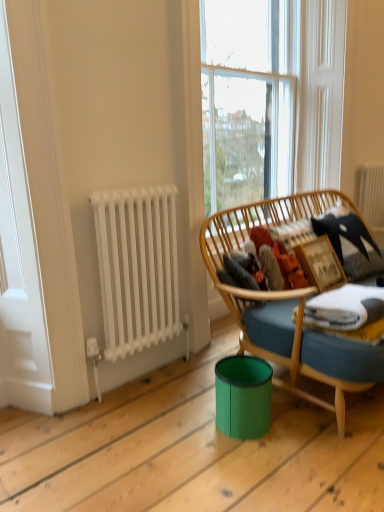
Question: Considering the relative positions of green plastic trash bin at lower center and white metallic radiator at left, marked as the 1th radiator in a front-to-back arrangement, in the image provided, is green plastic trash bin at lower center in front of white metallic radiator at left, marked as the 1th radiator in a front-to-back arrangement,?

Choices:
 (A) no
 (B) yes

Answer: (B)

Question: Is green plastic trash bin at lower center to the right of white metallic radiator at left, the 1th radiator positioned from the left, from the viewer's perspective?

Choices:
 (A) no
 (B) yes

Answer: (B)

Question: Considering the relative sizes of green plastic trash bin at lower center and white metallic radiator at left, which appears as the second radiator when viewed from the right, in the image provided, is green plastic trash bin at lower center smaller than white metallic radiator at left, which appears as the second radiator when viewed from the right,?

Choices:
 (A) no
 (B) yes

Answer: (B)

Question: Does green plastic trash bin at lower center have a lesser height compared to white metallic radiator at left, placed as the 1th radiator when sorted from bottom to top?

Choices:
 (A) yes
 (B) no

Answer: (A)

Question: Considering the relative sizes of green plastic trash bin at lower center and white metallic radiator at left, placed as the 1th radiator when sorted from bottom to top, in the image provided, is green plastic trash bin at lower center thinner than white metallic radiator at left, placed as the 1th radiator when sorted from bottom to top,?

Choices:
 (A) yes
 (B) no

Answer: (B)

Question: Would you say fuzzy fabric at center is to the left or to the right of wooden picture frame at right in the picture?

Choices:
 (A) right
 (B) left

Answer: (B)

Question: Is fuzzy fabric at center wider or thinner than wooden picture frame at right?

Choices:
 (A) thin
 (B) wide

Answer: (B)

Question: From the image's perspective, relative to wooden picture frame at right, is fuzzy fabric at center above or below?

Choices:
 (A) below
 (B) above

Answer: (B)

Question: From a real-world perspective, is fuzzy fabric at center positioned above or below wooden picture frame at right?

Choices:
 (A) below
 (B) above

Answer: (B)

Question: Looking at their shapes, would you say green plastic trash bin at lower center is wider or thinner than clear glass window at upper center?

Choices:
 (A) thin
 (B) wide

Answer: (B)

Question: From the image's perspective, is green plastic trash bin at lower center above or below clear glass window at upper center?

Choices:
 (A) above
 (B) below

Answer: (B)

Question: Considering their positions, is green plastic trash bin at lower center located in front of or behind clear glass window at upper center?

Choices:
 (A) front
 (B) behind

Answer: (A)

Question: Is green plastic trash bin at lower center taller or shorter than clear glass window at upper center?

Choices:
 (A) tall
 (B) short

Answer: (B)

Question: Looking at their shapes, would you say clear glass window at upper center is wider or thinner than fuzzy fabric at center?

Choices:
 (A) thin
 (B) wide

Answer: (A)

Question: From the image's perspective, is clear glass window at upper center positioned above or below fuzzy fabric at center?

Choices:
 (A) above
 (B) below

Answer: (A)